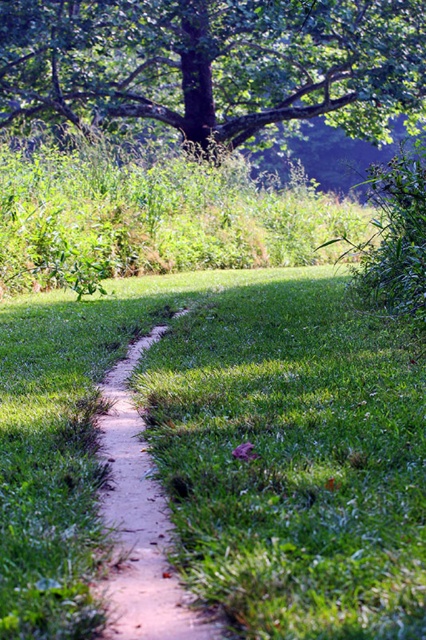
You are a hiker trying to find shade while walking along the narrow dirt path. You notice the green grassy at center and the green leafy tree at upper center. Which location would provide more shade?

The green leafy tree at upper center provides more shade because it is above the green grassy at center, which is located below it.

You are standing at the starting point of the dirt path and want to reach the green grassy at center. Which direction should you walk to reach it?

You should walk forward along the dirt path to reach the green grassy at center, as it is located directly ahead at point (224, 452).